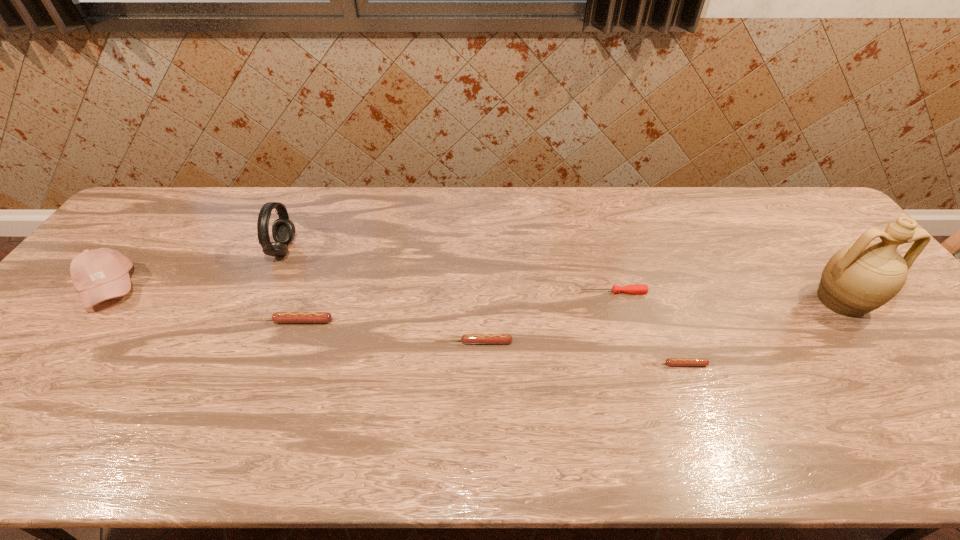
Locate an element on the screen. the fifth shortest object is located at coordinates (100, 274).

Find the location of `the leftmost object`. the leftmost object is located at coordinates (100, 274).

The height and width of the screenshot is (540, 960). Identify the location of vacant space located on the left of the fourth tallest object. (167, 321).

The image size is (960, 540). In order to click on free location located 0.220m on the back of the second shortest sausage in this screenshot , I will do `click(475, 275)`.

The image size is (960, 540). In order to click on vacant space located 0.050m on the front of the nearest sausage in this screenshot , I will do `click(684, 387)`.

The height and width of the screenshot is (540, 960). Identify the location of vacant space located at the tip of the screwdriver. [492, 292].

The image size is (960, 540). I want to click on free location located 0.280m at the tip of the screwdriver, so click(x=477, y=292).

Locate an element on the screen. vacant space located at the tip of the screwdriver is located at coordinates (517, 292).

I want to click on free space located 0.160m on the back of the tallest object, so click(x=796, y=242).

In order to click on free space located 0.350m on the earcups of the sixth shortest object in this screenshot , I will do `click(411, 249)`.